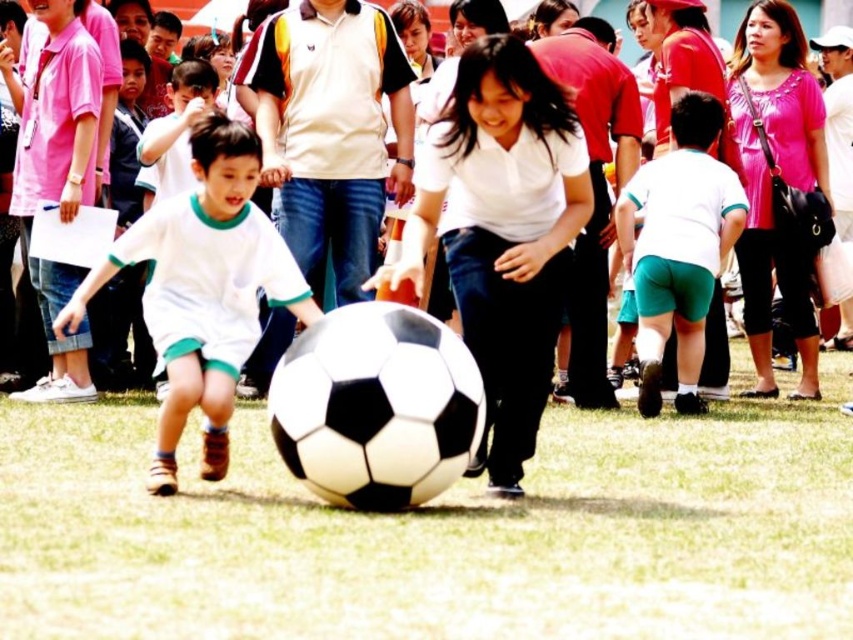
Is white matte soccer ball at lower left below green fabric shorts at lower right?

Indeed, white matte soccer ball at lower left is positioned under green fabric shorts at lower right.

Which of these two, white matte soccer ball at lower left or green fabric shorts at lower right, stands taller?

green fabric shorts at lower right is taller.

The width and height of the screenshot is (853, 640). Describe the element at coordinates (202, 289) in the screenshot. I see `white matte soccer ball at lower left` at that location.

I want to click on white matte soccer ball at lower left, so click(x=202, y=289).

Does white matte soccer ball at lower left have a greater width compared to matte white soccer ball at center?

No, white matte soccer ball at lower left is not wider than matte white soccer ball at center.

Is white matte soccer ball at lower left shorter than matte white soccer ball at center?

Correct, white matte soccer ball at lower left is not as tall as matte white soccer ball at center.

Is point (282, 266) less distant than point (97, 20)?

Yes, it is in front of point (97, 20).

Identify the location of white matte soccer ball at lower left. The height and width of the screenshot is (640, 853). (202, 289).

Which is in front, point (621, 243) or point (108, 58)?

Point (621, 243) is in front.

Does green fabric shorts at lower right have a lesser height compared to matte white soccer ball at center?

Yes.

This screenshot has height=640, width=853. What are the coordinates of `green fabric shorts at lower right` in the screenshot? It's located at (679, 248).